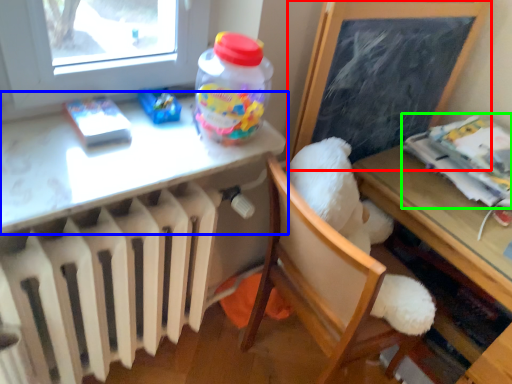
Question: Estimate the real-world distances between objects in this image. Which object is farther from bulletin board (highlighted by a red box), table (highlighted by a blue box) or magazine (highlighted by a green box)?

Choices:
 (A) table
 (B) magazine

Answer: (A)